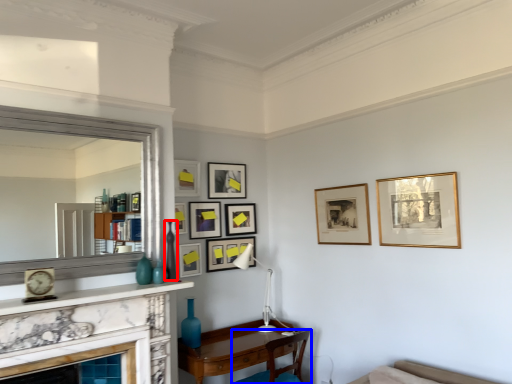
Question: Which point is closer to the camera, vase (highlighted by a red box) or chair (highlighted by a blue box)?

Choices:
 (A) vase
 (B) chair

Answer: (A)